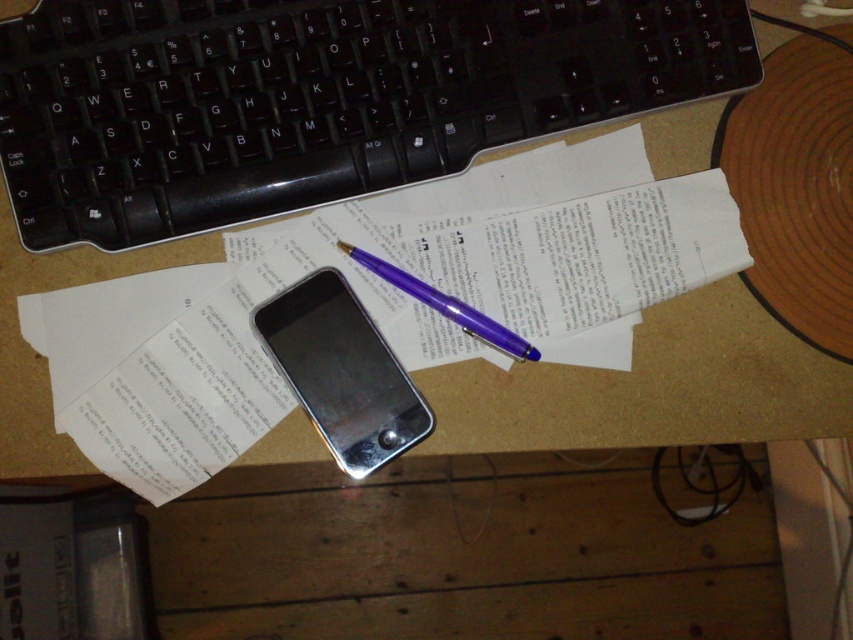
You are organizing your desk and want to place a new wireless charger that requires a 10cm x 10cm space. The charger must be placed exactly where the silver metallic smartphone at center is currently located. Is there enough space for the charger?

The silver metallic smartphone at center is located at point [341,372]. Since the charger requires a 10cm x 10cm space and the smartphone occupies that exact point, there should be sufficient space as long as the area around the point is clear. However, the description does not mention any obstructions at that location, so it is likely possible.

You are organizing your desk and want to place both the silver metallic smartphone at center and the purple glossy pen at center into a drawer. The drawer has a height limit of 10 cm. Can both items fit vertically in the drawer without bending or damaging the pen?

The silver metallic smartphone at center has a larger size compared to purple glossy pen at center. Since the smartphone is larger, it is likely taller than the pen. If the smartphone is under 10 cm in height, both can fit. However, if the smartphone exceeds 10 cm, only the pen would fit. Without exact measurements, we can only assume based on typical sizes. Smartphones are usually around 14 cm tall, exceeding the drawer height. Thus, the smartphone might not fit, but the pen likely will.